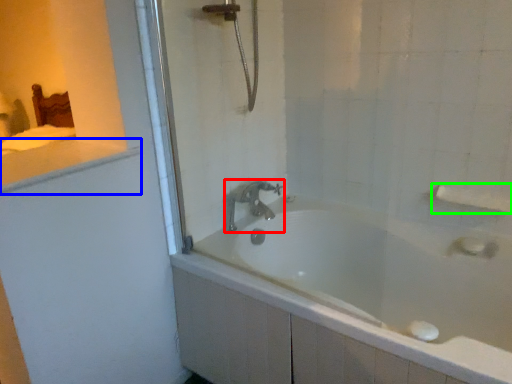
Question: Considering the real-world distances, which object is farthest from tap (highlighted by a red box)? counter top (highlighted by a blue box) or towel bar (highlighted by a green box)?

Choices:
 (A) counter top
 (B) towel bar

Answer: (B)